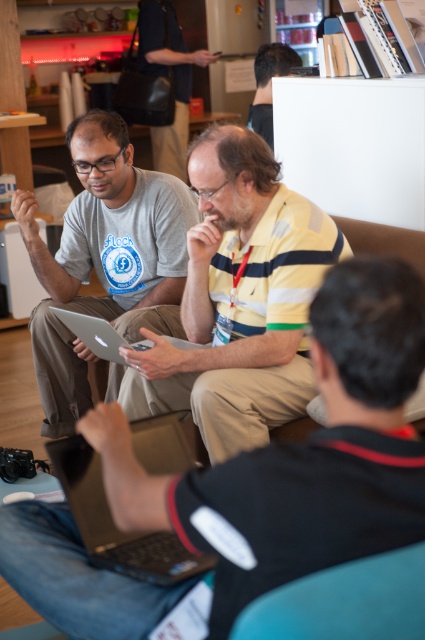
How much distance is there between black matte laptop at center and matte gray laptop at center?

black matte laptop at center and matte gray laptop at center are 1.49 meters apart.

Is point (251, 458) in front of point (90, 125)?

Yes, point (251, 458) is in front of point (90, 125).

This screenshot has height=640, width=425. I want to click on black matte laptop at center, so click(300, 452).

This screenshot has height=640, width=425. I want to click on black matte laptop at center, so click(300, 452).

Between point (257, 211) and point (260, 67), which one is positioned behind?

Positioned behind is point (260, 67).

Between yellow striped shirt at center and black matte hair at upper center, which one is positioned lower?

yellow striped shirt at center is below.

What do you see at coordinates (238, 300) in the screenshot?
I see `yellow striped shirt at center` at bounding box center [238, 300].

Locate an element on the screen. The image size is (425, 640). yellow striped shirt at center is located at coordinates (238, 300).

Is metallic silver laptop at lower center to the left of black matte hair at upper center from the viewer's perspective?

Yes, metallic silver laptop at lower center is to the left of black matte hair at upper center.

Which of these two, metallic silver laptop at lower center or black matte hair at upper center, stands shorter?

Standing shorter between the two is metallic silver laptop at lower center.

Is point (166, 460) in front of point (269, 56)?

Yes.

The width and height of the screenshot is (425, 640). Identify the location of metallic silver laptop at lower center. (115, 524).